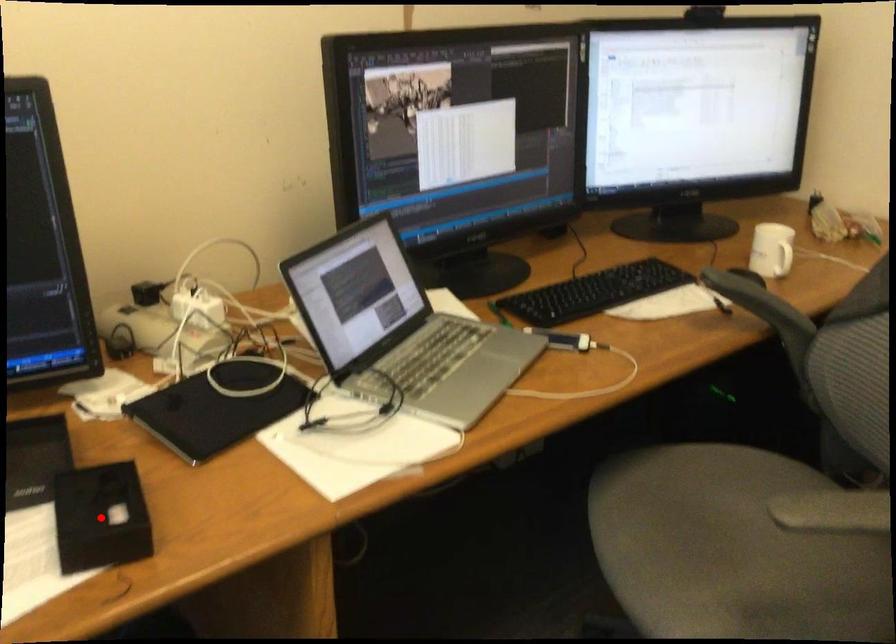
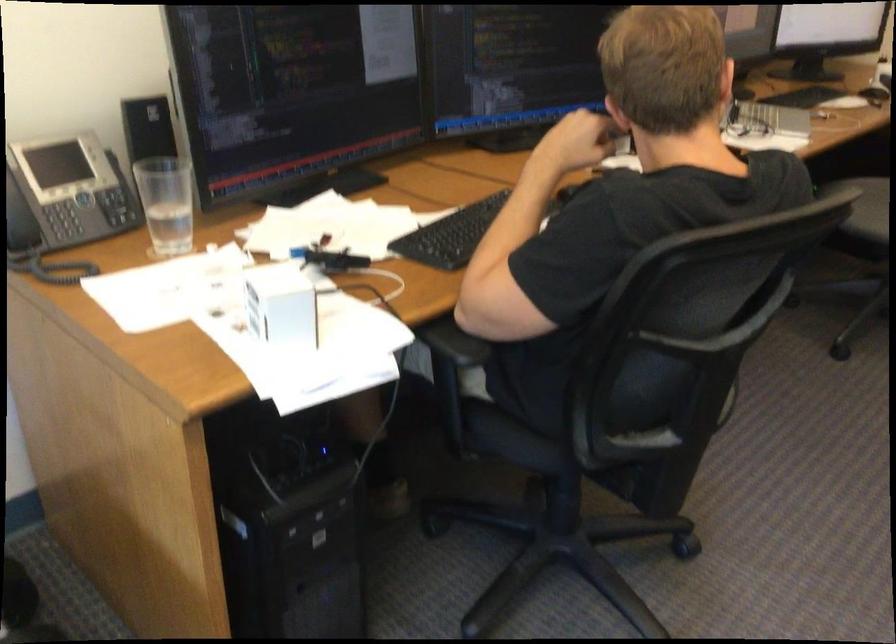
Question: I am providing you with two images of the same scene from different viewpoints. A red point is marked on the first image. Is the red point's position out of view in image 2?

Choices:
 (A) Yes
 (B) No

Answer: (A)